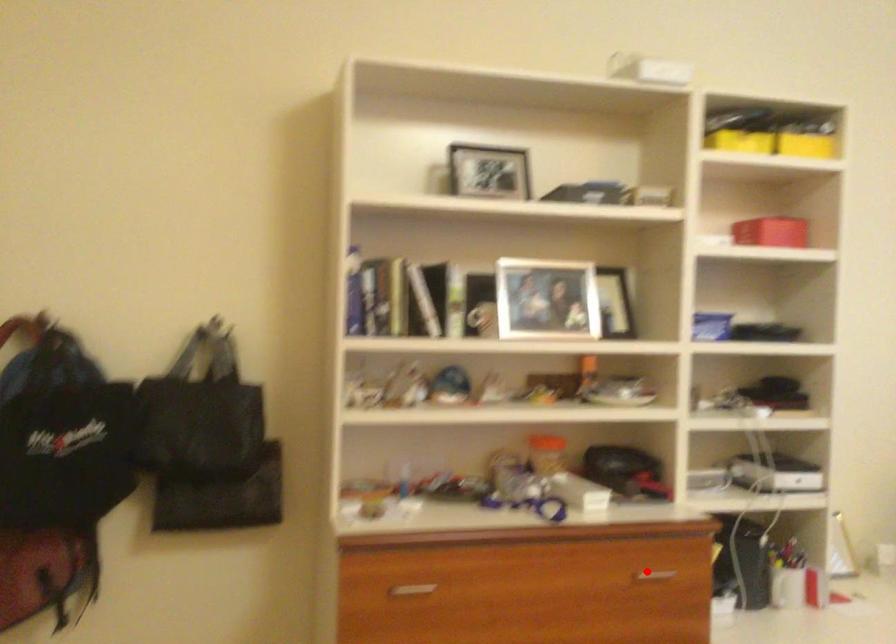
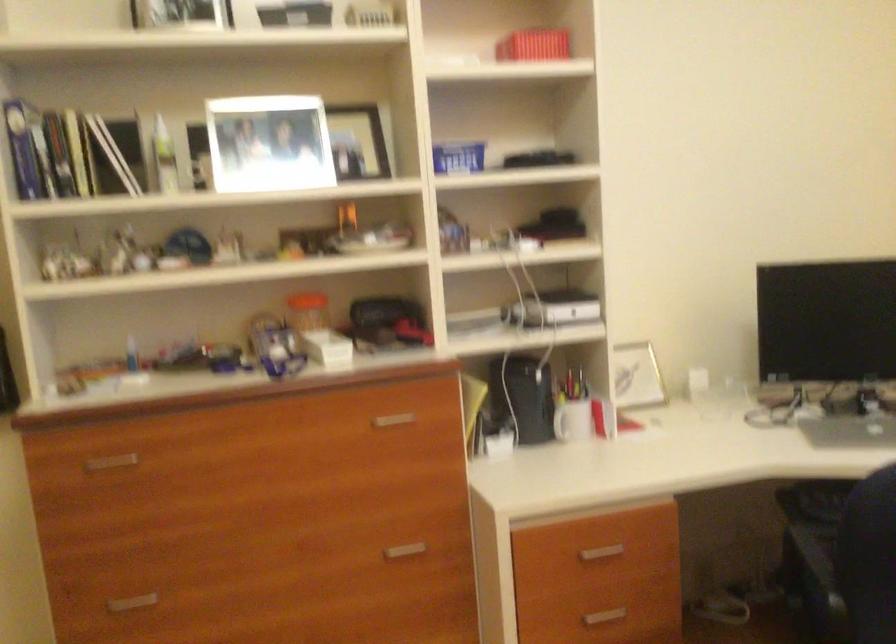
Find the pixel in the second image that matches the highlighted location in the first image.

(392, 420)